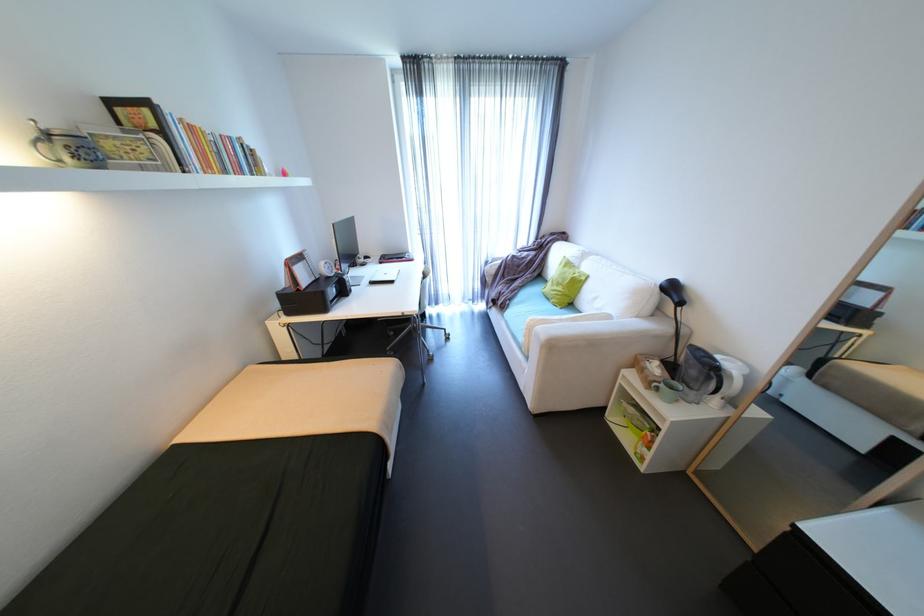
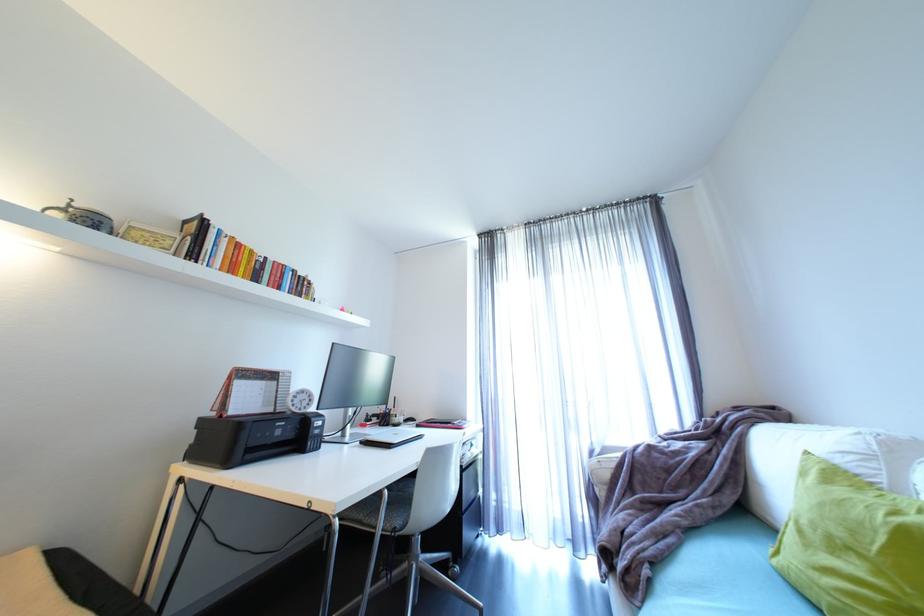
The point at [198,168] is marked in the first image. Where is the corresponding point in the second image?

(208, 262)